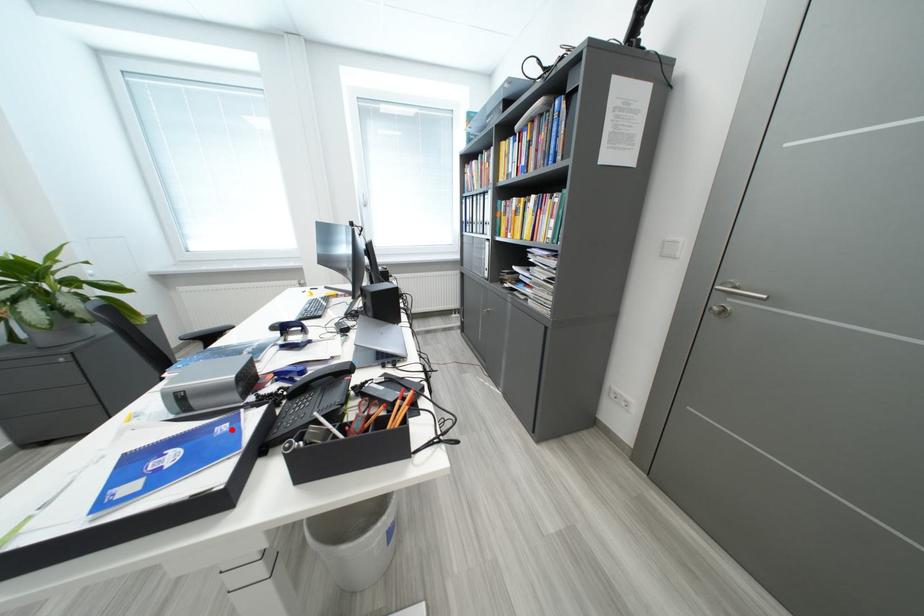
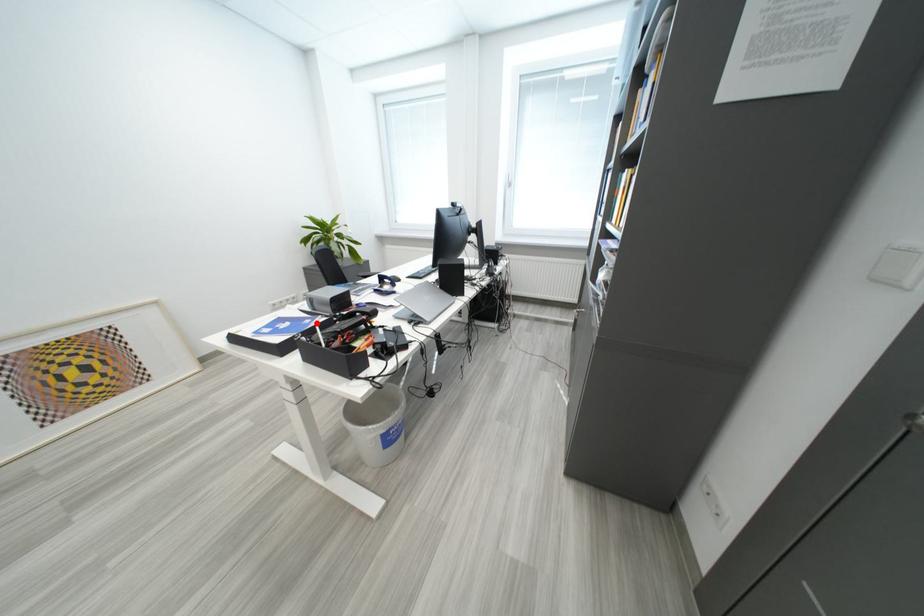
I am providing you with two images of the same scene from different viewpoints. A red point is marked on the first image and another point is marked on the second image. Is the marked point in image1 the same physical position as the marked point in image2?

Yes